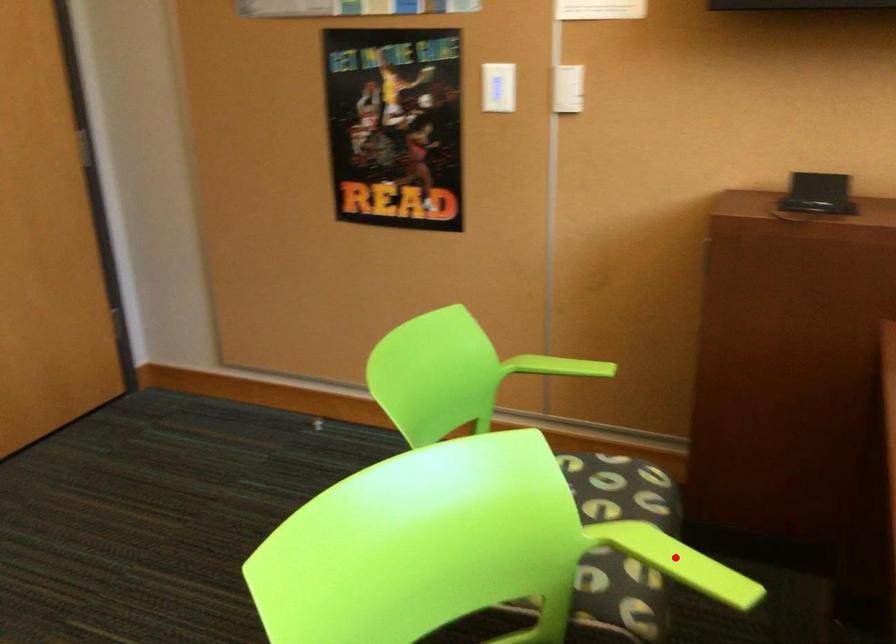
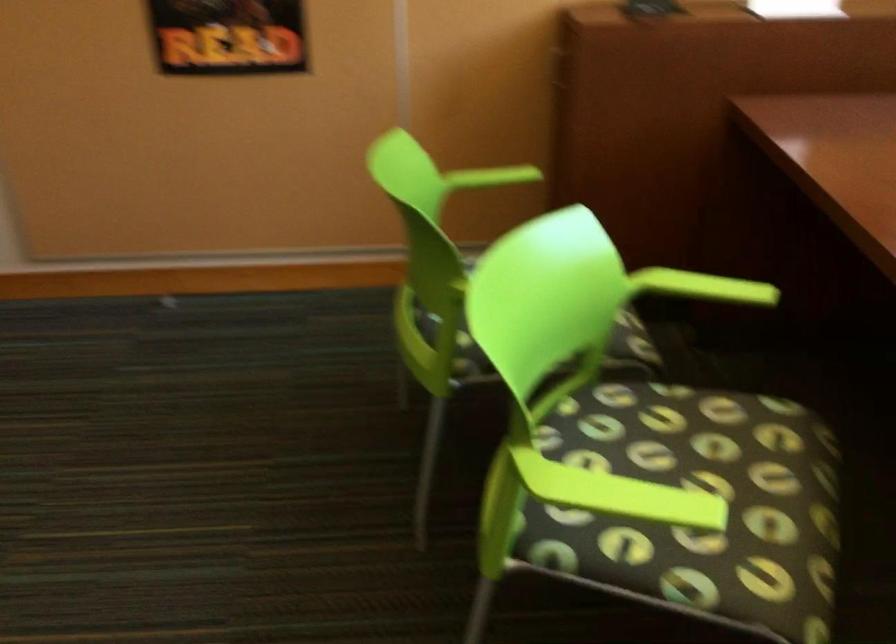
Question: A red point is marked in image1. In image2, is the corresponding 3D point closer to the camera or farther? Reply with the corresponding letter.

Choices:
 (A) The corresponding 3D point is closer.
 (B) The corresponding 3D point is farther.

Answer: (B)